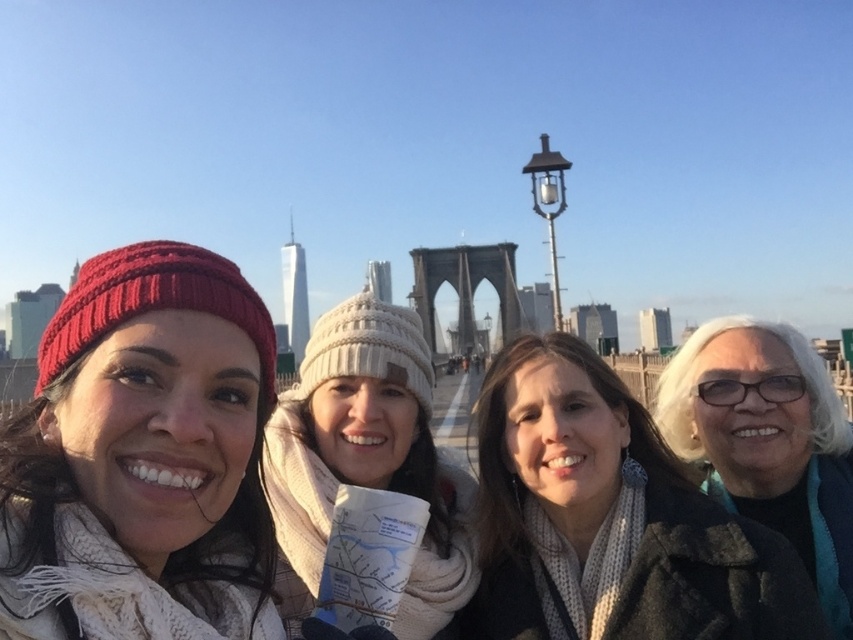
Does matte white scarf at center have a larger size compared to white glossy coat at lower right?

Actually, matte white scarf at center might be smaller than white glossy coat at lower right.

Describe the element at coordinates (608, 518) in the screenshot. The width and height of the screenshot is (853, 640). I see `matte white scarf at center` at that location.

The width and height of the screenshot is (853, 640). I want to click on matte white scarf at center, so click(608, 518).

Between knitted red beanie at left and white glossy coat at lower right, which one appears on the left side from the viewer's perspective?

Positioned to the left is knitted red beanie at left.

Which is below, knitted red beanie at left or white glossy coat at lower right?

white glossy coat at lower right is lower down.

Is point (9, 532) more distant than point (804, 372)?

No, it is in front of (804, 372).

You are a GUI agent. You are given a task and a screenshot of the screen. Output one action in this format:
    pyautogui.click(x=<x>, y=<y>)
    Task: Click on the knitted red beanie at left
    
    Given the screenshot: What is the action you would take?
    pyautogui.click(x=146, y=428)

Does point (265, 352) come in front of point (635, 557)?

No, (265, 352) is further to viewer.

Can you confirm if knitted red beanie at left is positioned below matte white scarf at center?

No.

Identify the location of knitted red beanie at left. (146, 428).